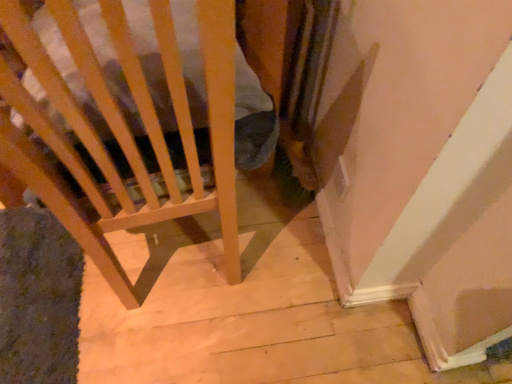
This screenshot has height=384, width=512. Find the location of `light brown wooden chair at center`. light brown wooden chair at center is located at coordinates (123, 128).

Describe the element at coordinates (123, 128) in the screenshot. The image size is (512, 384). I see `light brown wooden chair at center` at that location.

You are a GUI agent. You are given a task and a screenshot of the screen. Output one action in this format:
    pyautogui.click(x=<x>, y=<y>)
    Task: Click on the light brown wooden chair at center
    
    Given the screenshot: What is the action you would take?
    pyautogui.click(x=123, y=128)